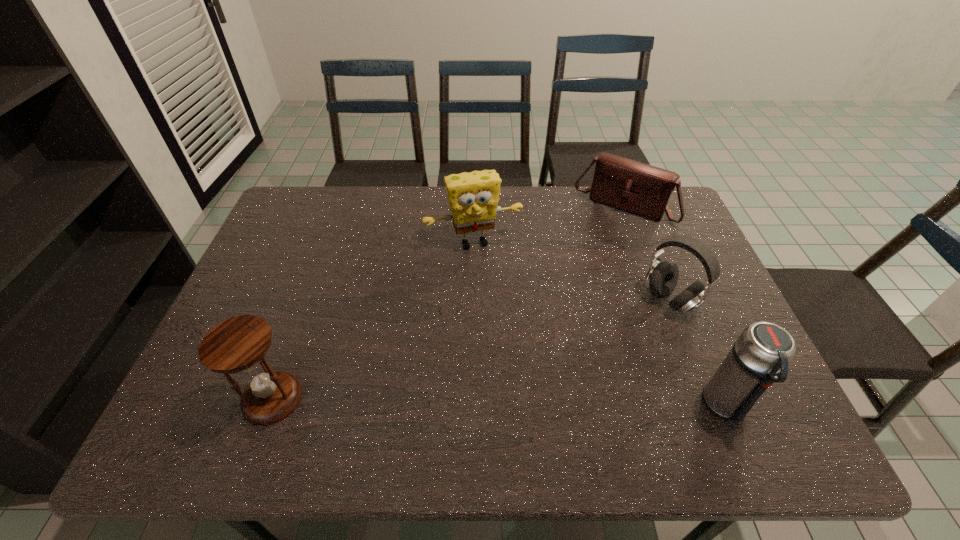
This screenshot has width=960, height=540. Identify the location of object that can be found as the second closest to the hourglass. (662, 277).

The image size is (960, 540). I want to click on free region that satisfies the following two spatial constraints: 1. on the front side of the headset; 2. on the right side of the shortest object, so click(658, 300).